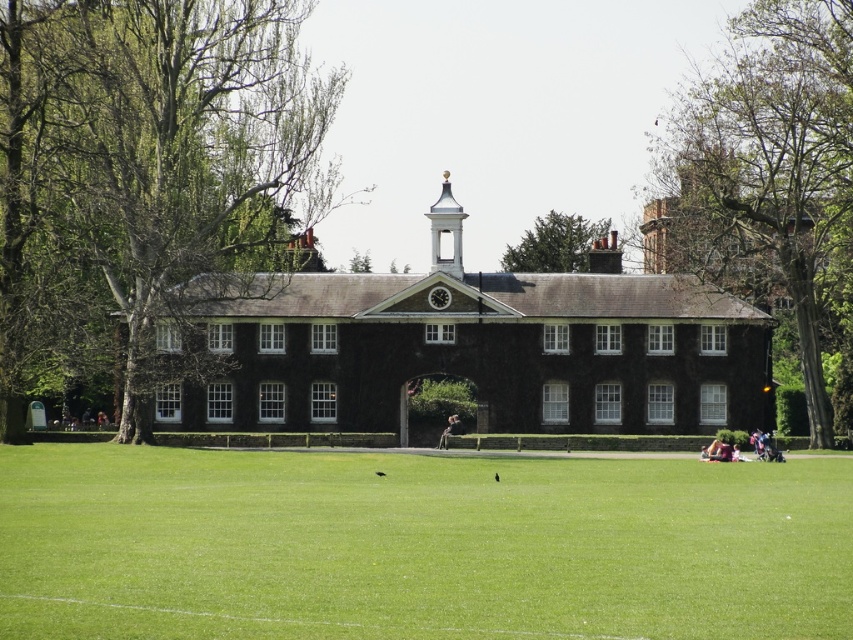
Question: Does green leafy tree at center have a smaller size compared to green leafy tree at upper center?

Choices:
 (A) no
 (B) yes

Answer: (A)

Question: Which point is farther to the camera?

Choices:
 (A) green grass at center
 (B) light brown leather jacket at center
 (C) green leafy tree at upper center

Answer: (C)

Question: Which object appears farthest from the camera in this image?

Choices:
 (A) green leafy tree at right
 (B) green leafy tree at upper center

Answer: (B)

Question: Is green leafy tree at right above light brown leather jacket at center?

Choices:
 (A) yes
 (B) no

Answer: (A)

Question: Does green grass at center appear over green leafy tree at right?

Choices:
 (A) yes
 (B) no

Answer: (B)

Question: Which point is farther from the camera taking this photo?

Choices:
 (A) (447, 429)
 (B) (515, 269)

Answer: (B)